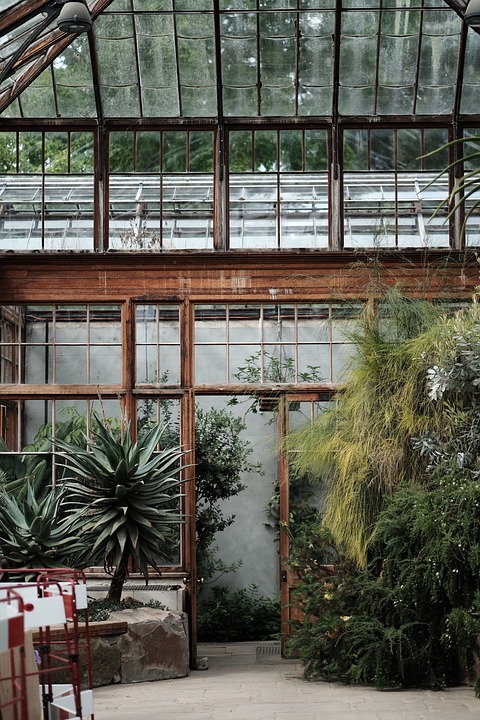
At what (x,y) coordinates should I click in order to perform the action: click on side windows. Please return your answer as a coordinate pair (x, y). The image size is (480, 720). Looking at the image, I should click on (49, 150), (283, 147), (178, 145), (298, 228), (238, 332), (73, 369).